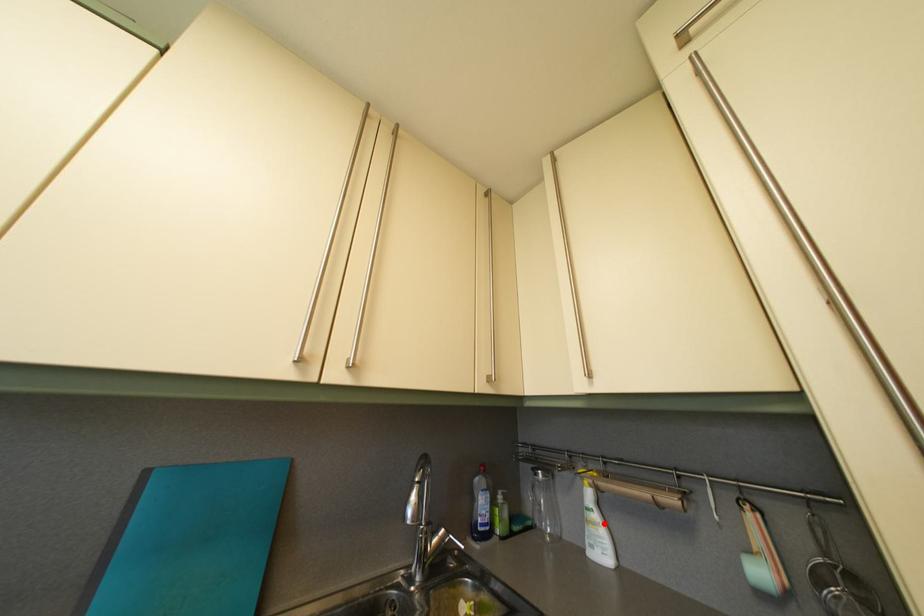
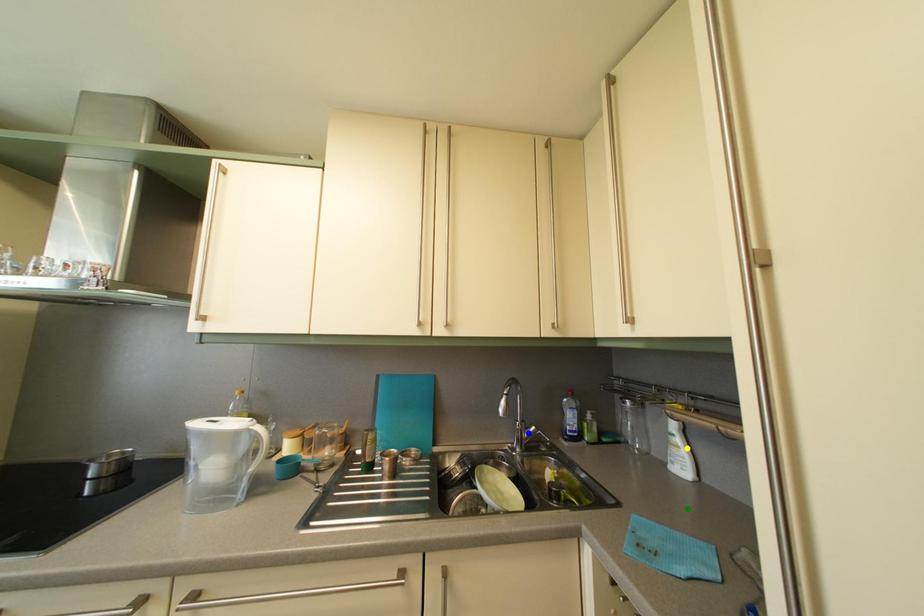
Question: I am providing you with two images of the same scene from different viewpoints. A red point is marked on the first image. You are given multiple points on the second image. Which point in image 2 represents the same 3d spot as the red point in image 1?

Choices:
 (A) green point
 (B) yellow point
 (C) blue point

Answer: (B)